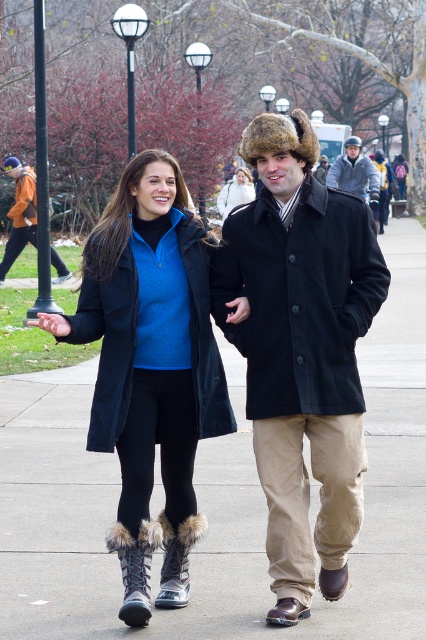
Looking at this image, you are a photographer trying to capture a candid shot of the two people in the scene. You want to focus on the dark brown fur hat at center and the black wool coat at center. Which object is positioned lower in the image?

The dark brown fur hat at center is positioned below the black wool coat at center, so it is lower in the image.

You are a photographer standing behind the two people in the image. You want to take a photo that includes both the dark brown fur hat at center and the black wool coat at center without any part of them being cut off. Which object will require you to adjust your camera angle more to ensure it fits in the frame?

The dark brown fur hat at center is much taller than the black wool coat at center, so you will need to adjust your camera angle more to accommodate its height to ensure it fits in the frame without being cut off.

You are standing at the point with coordinates point (x=16, y=163) and want to walk towards the point with coordinates point (x=354, y=154). Which direction should you face to walk directly towards it?

To walk directly from point (x=16, y=163) to point (x=354, y=154), you should face north because the destination point is north of the starting point.